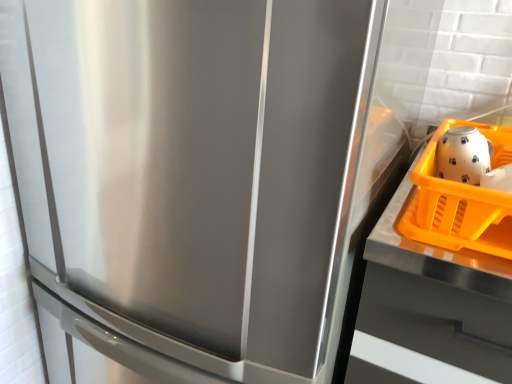
You are a GUI agent. You are given a task and a screenshot of the screen. Output one action in this format:
    pyautogui.click(x=<x>, y=<y>)
    Task: Click on the orange plastic basket at right
    This screenshot has height=384, width=512.
    Given the screenshot: What is the action you would take?
    pyautogui.click(x=461, y=202)

Measure the distance between point (487,141) and camera.

Point (487,141) is 70.20 centimeters away from camera.

What are the coordinates of `orange plastic tray at right` in the screenshot? It's located at (429, 309).

Considering the relative positions of orange plastic tray at right and orange plastic basket at right in the image provided, is orange plastic tray at right to the left or to the right of orange plastic basket at right?

orange plastic tray at right is positioned on orange plastic basket at right's right side.

What's the angular difference between orange plastic tray at right and orange plastic basket at right's facing directions?

1.09 degrees.

Based on the photo, is orange plastic tray at right wider than orange plastic basket at right?

Indeed, orange plastic tray at right has a greater width compared to orange plastic basket at right.

Is orange plastic tray at right not close to orange plastic basket at right?

No, orange plastic tray at right is not far away from orange plastic basket at right.

Is white glossy tea pot at upper right aimed at orange plastic basket at right?

Yes, white glossy tea pot at upper right is oriented towards orange plastic basket at right.

Between white glossy tea pot at upper right and orange plastic basket at right, which one appears on the right side from the viewer's perspective?

orange plastic basket at right.

Is white glossy tea pot at upper right spatially inside orange plastic basket at right, or outside of it?

white glossy tea pot at upper right fits inside orange plastic basket at right.

Considering the relative sizes of orange plastic basket at right and orange plastic tray at right in the image provided, is orange plastic basket at right wider than orange plastic tray at right?

No.

Locate an element on the screen. Image resolution: width=512 pixels, height=384 pixels. basket to the left of orange plastic tray at right is located at coordinates (461, 202).

What's the angular difference between orange plastic basket at right and orange plastic tray at right's facing directions?

1.09 degrees separate the facing orientations of orange plastic basket at right and orange plastic tray at right.

Considering the sizes of orange plastic basket at right and orange plastic tray at right in the image, is orange plastic basket at right bigger or smaller than orange plastic tray at right?

Clearly, orange plastic basket at right is smaller in size than orange plastic tray at right.

Could you tell me if orange plastic basket at right is turned towards white glossy tea pot at upper right?

Yes, orange plastic basket at right is oriented towards white glossy tea pot at upper right.

Looking at this image, can you tell me how much orange plastic basket at right and white glossy tea pot at upper right differ in facing direction?

The angular difference between orange plastic basket at right and white glossy tea pot at upper right is 3.04e-05 degrees.

Is orange plastic basket at right shorter than white glossy tea pot at upper right?

No.

Is orange plastic basket at right smaller than white glossy tea pot at upper right?

Actually, orange plastic basket at right might be larger than white glossy tea pot at upper right.

Considering the sizes of objects orange plastic tray at right and white glossy tea pot at upper right in the image provided, who is taller, orange plastic tray at right or white glossy tea pot at upper right?

orange plastic tray at right.

Considering the relative positions of orange plastic tray at right and white glossy tea pot at upper right in the image provided, is orange plastic tray at right in front of white glossy tea pot at upper right?

Yes, it is in front of white glossy tea pot at upper right.

From the image's perspective, which one is positioned lower, orange plastic tray at right or white glossy tea pot at upper right?

orange plastic tray at right appears lower in the image.

How distant is white glossy tea pot at upper right from orange plastic tray at right?

white glossy tea pot at upper right and orange plastic tray at right are 8.60 inches apart.

From a real-world perspective, between white glossy tea pot at upper right and orange plastic tray at right, who is vertically higher?

From a 3D spatial view, white glossy tea pot at upper right is above.

Does point (449, 158) lie behind point (367, 334)?

Yes, point (449, 158) is farther from viewer.

Is white glossy tea pot at upper right oriented away from orange plastic tray at right?

No, white glossy tea pot at upper right is not facing the opposite direction of orange plastic tray at right.

In order to click on basket located above the orange plastic tray at right (from the image's perspective) in this screenshot , I will do `click(461, 202)`.

This screenshot has width=512, height=384. Find the location of `tea pot that is on the left side of orange plastic basket at right`. tea pot that is on the left side of orange plastic basket at right is located at coordinates (463, 155).

When comparing their distances from white glossy tea pot at upper right, does orange plastic tray at right or orange plastic basket at right seem further?

Among the two, orange plastic tray at right is located further to white glossy tea pot at upper right.

Estimate the real-world distances between objects in this image. Which object is further from orange plastic basket at right, orange plastic tray at right or white glossy tea pot at upper right?

Among the two, orange plastic tray at right is located further to orange plastic basket at right.

Which object lies further to the anchor point orange plastic tray at right, white glossy tea pot at upper right or orange plastic basket at right?

Based on the image, white glossy tea pot at upper right appears to be further to orange plastic tray at right.

From the image, which object appears to be farther from orange plastic basket at right, white glossy tea pot at upper right or orange plastic tray at right?

orange plastic tray at right is positioned further to the anchor orange plastic basket at right.

When comparing their distances from orange plastic tray at right, does orange plastic basket at right or white glossy tea pot at upper right seem further?

Among the two, white glossy tea pot at upper right is located further to orange plastic tray at right.

Based on their spatial positions, is orange plastic basket at right or orange plastic tray at right further from white glossy tea pot at upper right?

orange plastic tray at right is positioned further to the anchor white glossy tea pot at upper right.

Locate an element on the screen. basket between white glossy tea pot at upper right and orange plastic tray at right in the up-down direction is located at coordinates (461, 202).